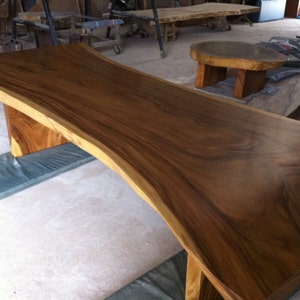
Where is `floor`? The image size is (300, 300). floor is located at coordinates 78,232, 176,67.